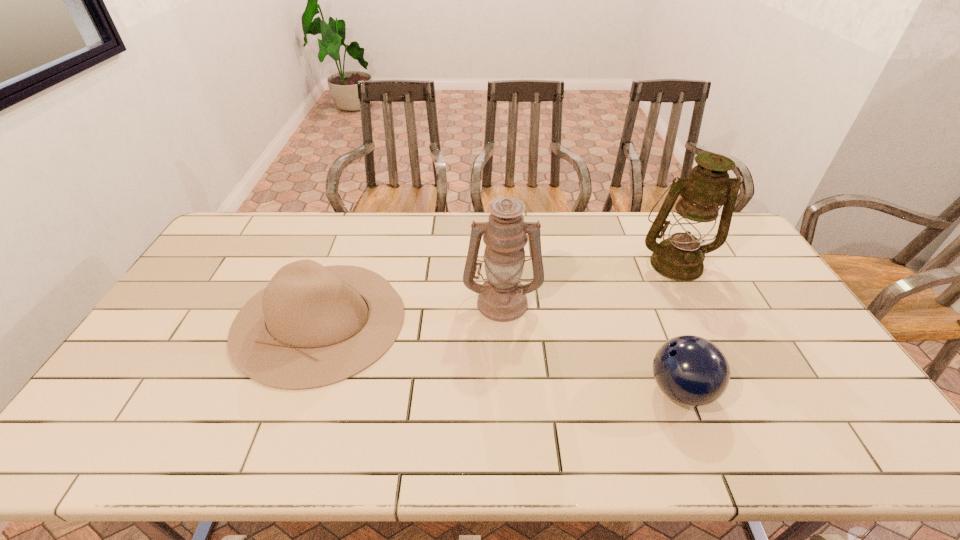
Identify the location of vacant position located 0.260m on the surface of the bowling ball near the finger holes. (545, 390).

Find the location of `object that is at the far edge`. object that is at the far edge is located at coordinates (680, 257).

Identify the location of object located in the right edge section of the desktop. click(680, 257).

At what (x,y) coordinates should I click in order to perform the action: click on object present at the far right corner. Please return your answer as a coordinate pair (x, y). Image resolution: width=960 pixels, height=540 pixels. Looking at the image, I should click on (680, 257).

In the image, there is a desktop. At what (x,y) coordinates should I click in order to perform the action: click on free space at the far edge. Please return your answer as a coordinate pair (x, y). This screenshot has height=540, width=960. Looking at the image, I should click on (614, 215).

You are a GUI agent. You are given a task and a screenshot of the screen. Output one action in this format:
    pyautogui.click(x=<x>, y=<y>)
    Task: Click on the vacant region at the near edge of the desktop
    This screenshot has height=540, width=960.
    Given the screenshot: What is the action you would take?
    pyautogui.click(x=211, y=425)

Locate an element on the screen. The image size is (960, 540). free location at the far right corner of the desktop is located at coordinates click(x=732, y=236).

Find the location of `free space between the bowling ball and the right oil lamp`. free space between the bowling ball and the right oil lamp is located at coordinates (678, 327).

Locate an element on the screen. This screenshot has height=540, width=960. empty space between the leftmost object and the bowling ball is located at coordinates (500, 355).

You are a GUI agent. You are given a task and a screenshot of the screen. Output one action in this format:
    pyautogui.click(x=<x>, y=<y>)
    Task: Click on the vacant area that lies between the second object from left to right and the leftmost object
    
    Given the screenshot: What is the action you would take?
    pyautogui.click(x=411, y=310)